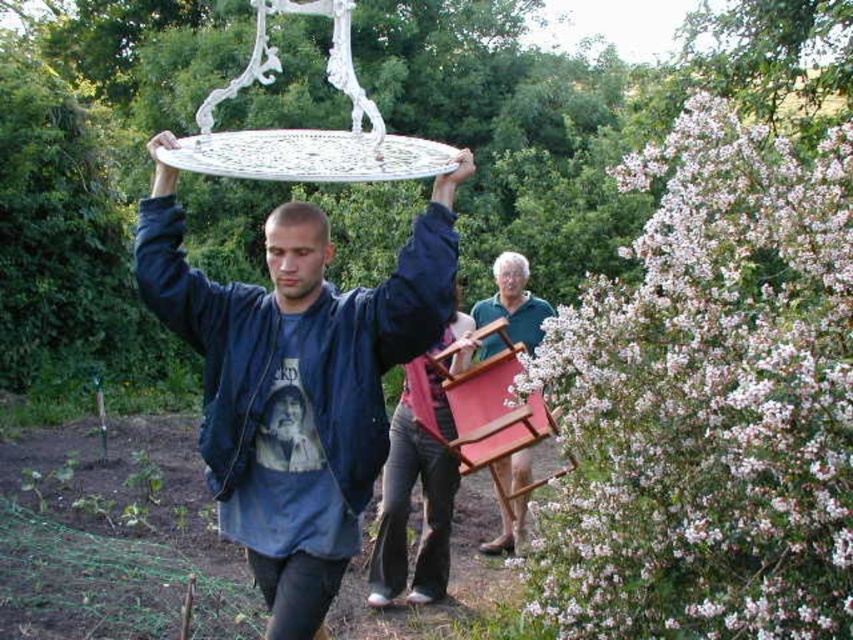
You are a photographer trying to capture both the teal fabric shirt at center and the smooth blue shirt at center in a single shot. Which shirt should you focus on to ensure the other remains in the background?

You should focus on the teal fabric shirt at center since it is closer to the viewer and the smooth blue shirt at center will naturally be in the background.

Looking at this image, you are standing at the origin point in the image. Which direction should you move to reach the teal fabric shirt at center?

The teal fabric shirt at center is located at point 0.473 on the x and 0.603 on the y axis, so you should move northeast to reach it.